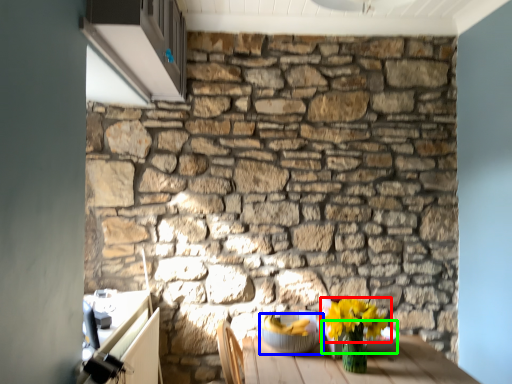
Question: Which object is the farthest from flower (highlighted by a red box)? Choose among these: glass bowl (highlighted by a blue box) or glass bowl (highlighted by a green box).

Choices:
 (A) glass bowl
 (B) glass bowl

Answer: (A)